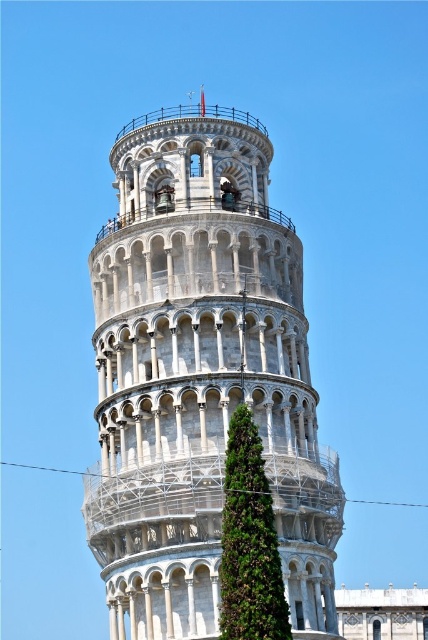
Who is positioned more to the left, white stone tower at center or green leafy tree at center?

white stone tower at center is more to the left.

Who is shorter, white stone tower at center or green leafy tree at center?

green leafy tree at center is shorter.

Is point (178, 513) positioned behind point (265, 625)?

Yes, it is.

You are a GUI agent. You are given a task and a screenshot of the screen. Output one action in this format:
    pyautogui.click(x=<x>, y=<y>)
    Task: Click on the white stone tower at center
    
    Given the screenshot: What is the action you would take?
    pyautogui.click(x=201, y=378)